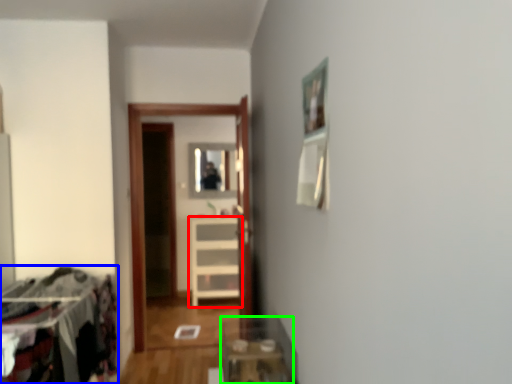
Question: Based on their relative distances, which object is nearer to furniture (highlighted by a red box)? Choose from laundry (highlighted by a blue box) and table (highlighted by a green box).

Choices:
 (A) laundry
 (B) table

Answer: (B)